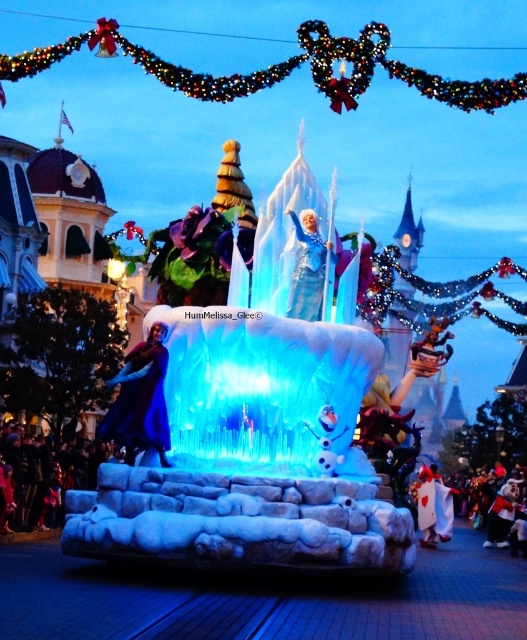
Is blue satin dress at center smaller than white fluffy dress at lower right?

Correct, blue satin dress at center occupies less space than white fluffy dress at lower right.

Measure the distance between blue satin dress at center and white fluffy dress at lower right.

blue satin dress at center is 85.01 feet from white fluffy dress at lower right.

In order to click on blue satin dress at center in this screenshot , I will do point(308,268).

Can you confirm if white fluffy dress at lower right is smaller than velvet plush teddy bear at lower right?

Incorrect, white fluffy dress at lower right is not smaller in size than velvet plush teddy bear at lower right.

Between white fluffy dress at lower right and velvet plush teddy bear at lower right, which one appears on the right side from the viewer's perspective?

velvet plush teddy bear at lower right

Describe the element at coordinates (434, 508) in the screenshot. The height and width of the screenshot is (640, 527). I see `white fluffy dress at lower right` at that location.

Where is `white fluffy dress at lower right`? The image size is (527, 640). white fluffy dress at lower right is located at coordinates (434, 508).

Can you confirm if matte blue gown at left is shorter than white fluffy dress at lower right?

No, matte blue gown at left is not shorter than white fluffy dress at lower right.

Who is shorter, matte blue gown at left or white fluffy dress at lower right?

white fluffy dress at lower right is shorter.

Does point (154, 417) come closer to viewer compared to point (445, 531)?

Yes, point (154, 417) is in front of point (445, 531).

Find the location of a particular element. Image resolution: width=527 pixels, height=640 pixels. matte blue gown at left is located at coordinates (141, 401).